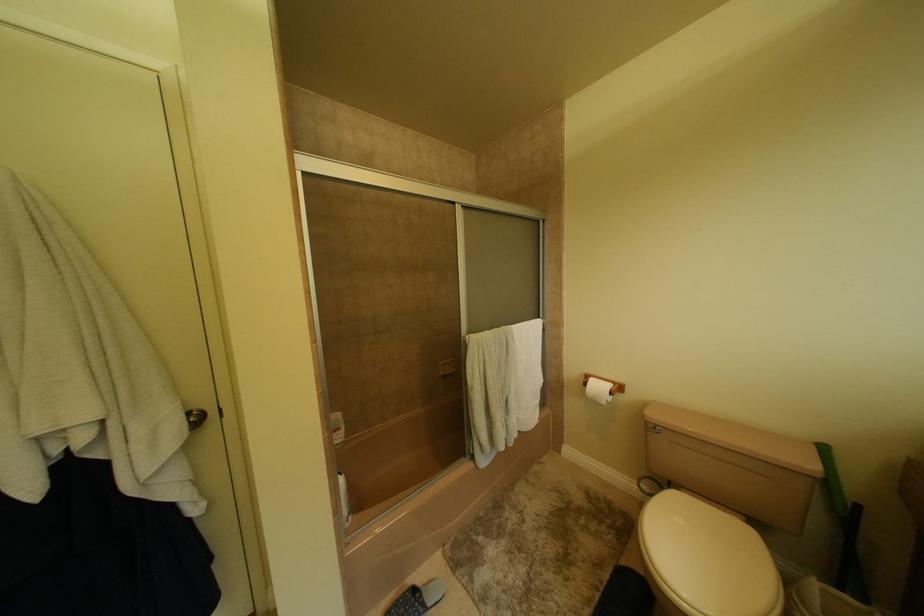
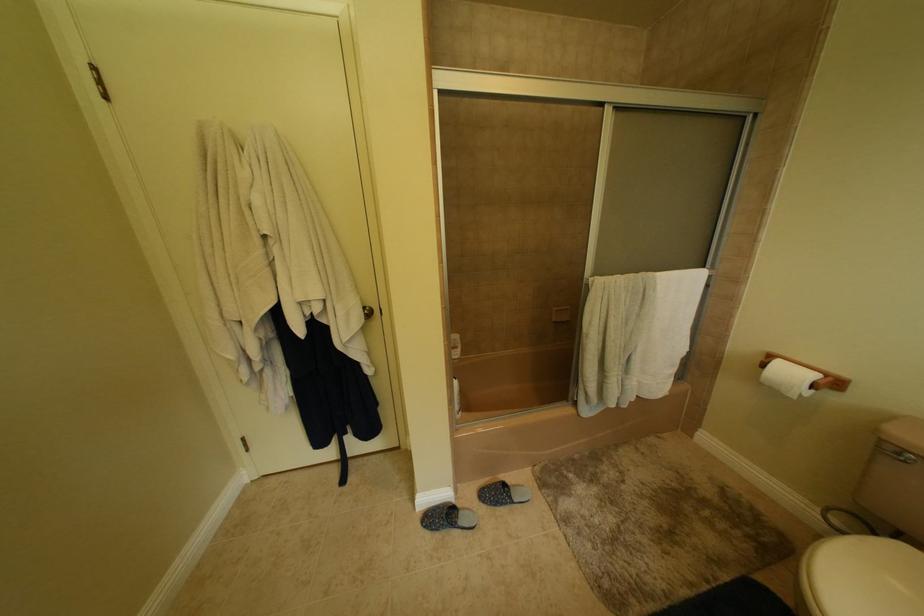
Based on the photo, in a continuous first-person perspective shot, in which direction is the camera moving?

The movement direction of the cameraman is right, forward.